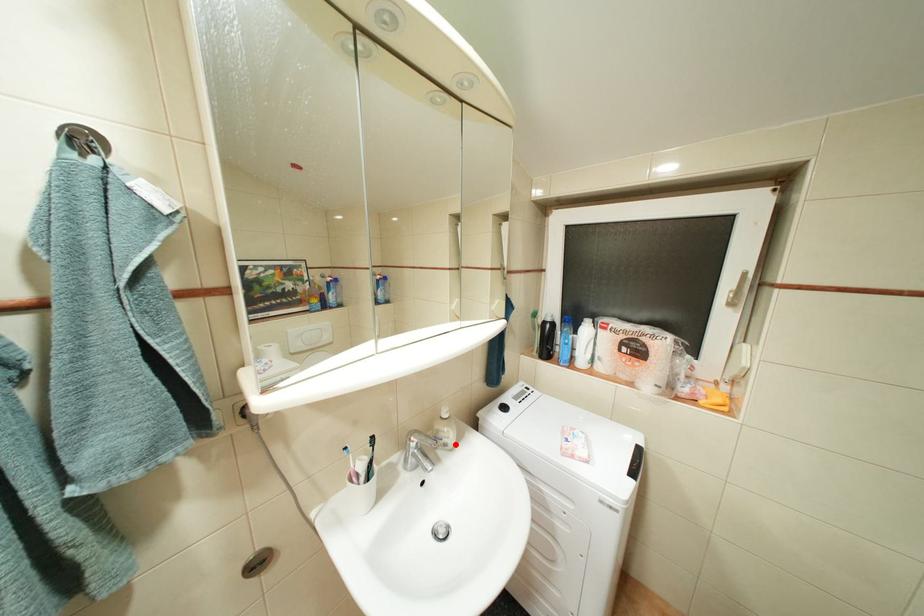
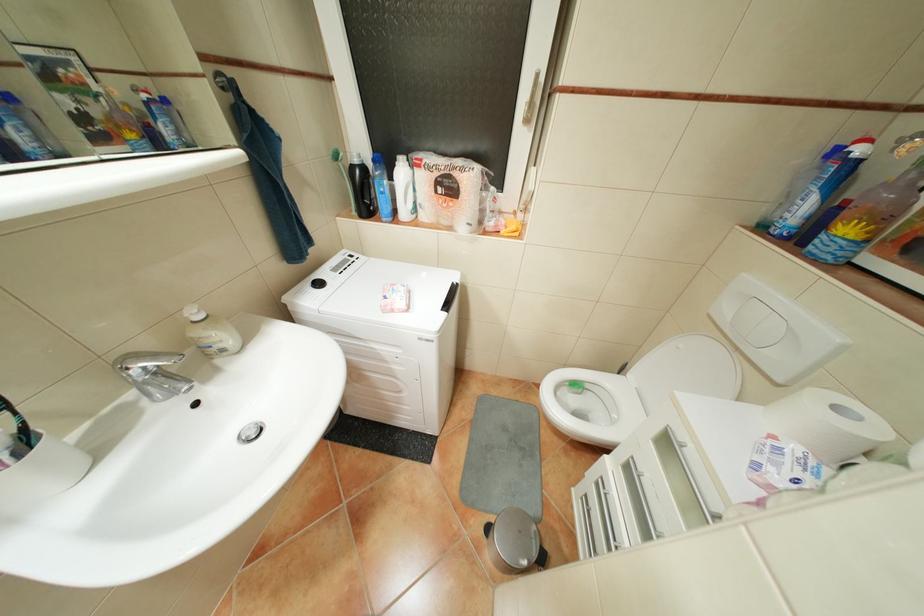
In the second image, find the point that corresponds to the highlighted location in the first image.

(233, 350)